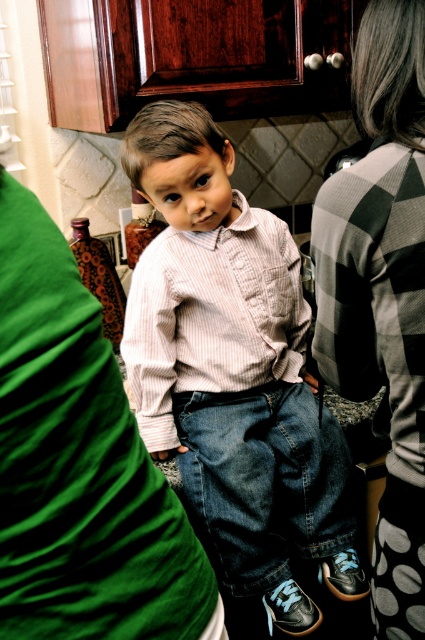
Question: Which object appears closest to the camera in this image?

Choices:
 (A) striped cotton shirt at center
 (B) pink striped shirt at center

Answer: (A)

Question: Does checkered fabric sweater at right appear on the right side of pink striped shirt at center?

Choices:
 (A) yes
 (B) no

Answer: (A)

Question: Can you confirm if striped cotton shirt at center is positioned to the right of pink striped shirt at center?

Choices:
 (A) yes
 (B) no

Answer: (A)

Question: Which object is farther from the camera taking this photo?

Choices:
 (A) striped cotton shirt at center
 (B) checkered fabric sweater at right
 (C) pink striped shirt at center

Answer: (C)

Question: Is striped cotton shirt at center wider than pink striped shirt at center?

Choices:
 (A) yes
 (B) no

Answer: (A)

Question: Which is farther from the checkered fabric sweater at right?

Choices:
 (A) striped cotton shirt at center
 (B) pink striped shirt at center

Answer: (B)